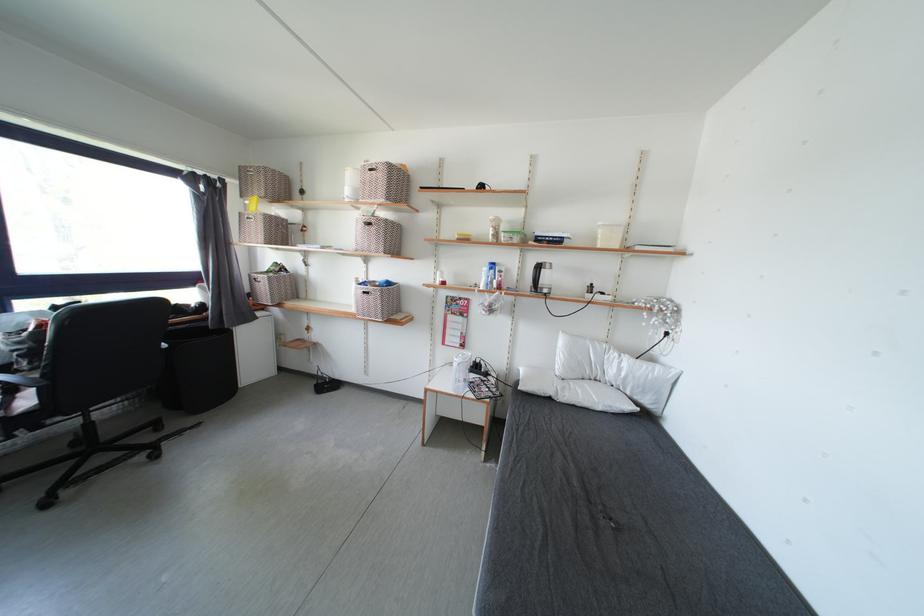
This screenshot has width=924, height=616. What are the coordinates of `chair sitting surface` in the screenshot? It's located at (18, 397).